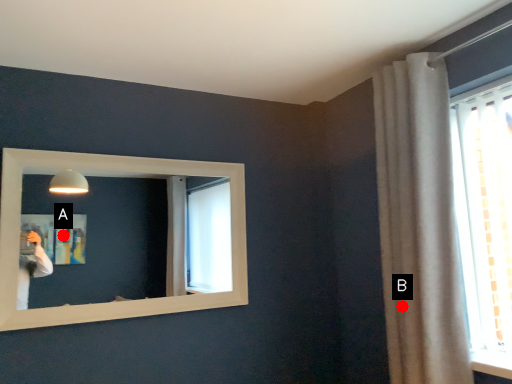
Question: Two points are circled on the image, labeled by A and B beside each circle. Which of the following is the closest to the observer?

Choices:
 (A) A is closer
 (B) B is closer

Answer: (B)